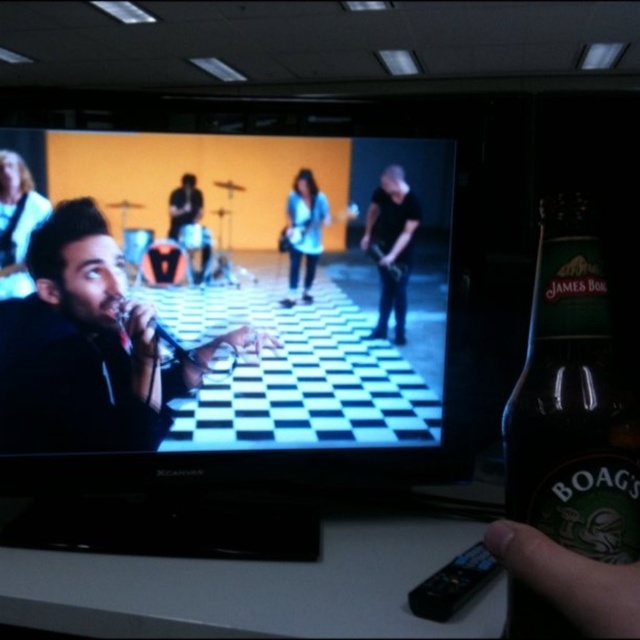
Question: Which point is closer to the camera?

Choices:
 (A) (337, 145)
 (B) (410, 211)

Answer: (A)

Question: Is matte black microphone at center smaller than green glass bottle at right?

Choices:
 (A) yes
 (B) no

Answer: (B)

Question: Is black matte microphone at center positioned at the back of light blue denim jacket at center?

Choices:
 (A) yes
 (B) no

Answer: (B)

Question: Which point is farther to the camera?

Choices:
 (A) (525, 525)
 (B) (168, 408)
 (C) (26, 276)

Answer: (B)

Question: Is black matte microphone at center smaller than shiny silver guitar at upper left?

Choices:
 (A) no
 (B) yes

Answer: (A)

Question: Which is farther from the shiny silver guitar at upper left?

Choices:
 (A) dark skin hand at lower right
 (B) black matte guitar at center
 (C) light blue denim jacket at center
 (D) black matte microphone at center

Answer: (A)